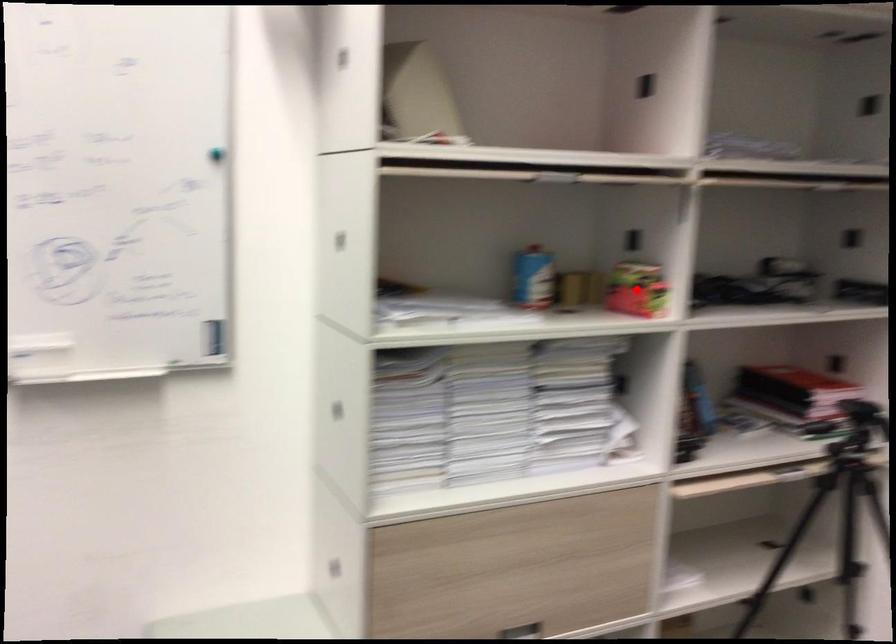
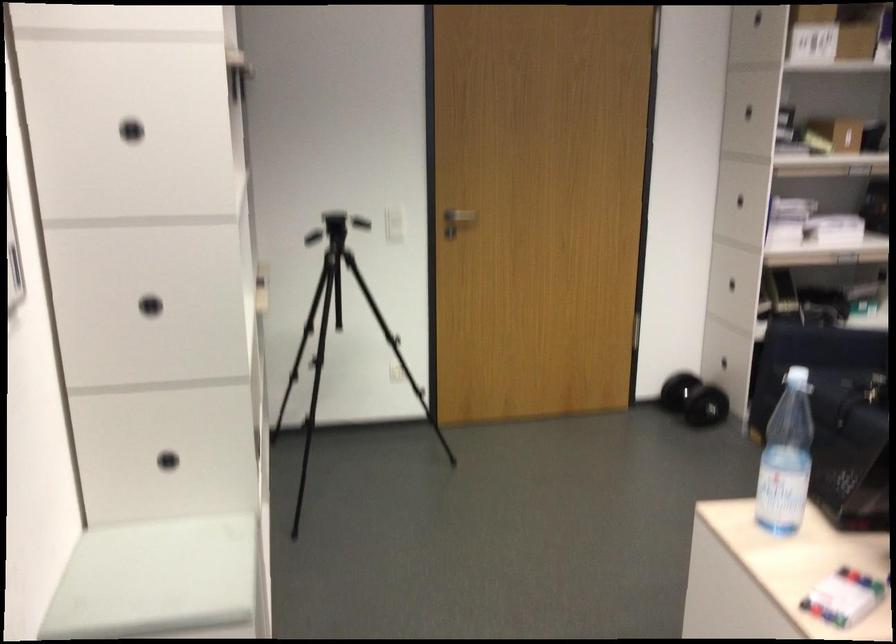
Question: I am providing you with two images of the same scene from different viewpoints. A red point is marked on the first image. At the location where the point appears in image 1, is it still visible in image 2?

Choices:
 (A) Yes
 (B) No

Answer: (B)